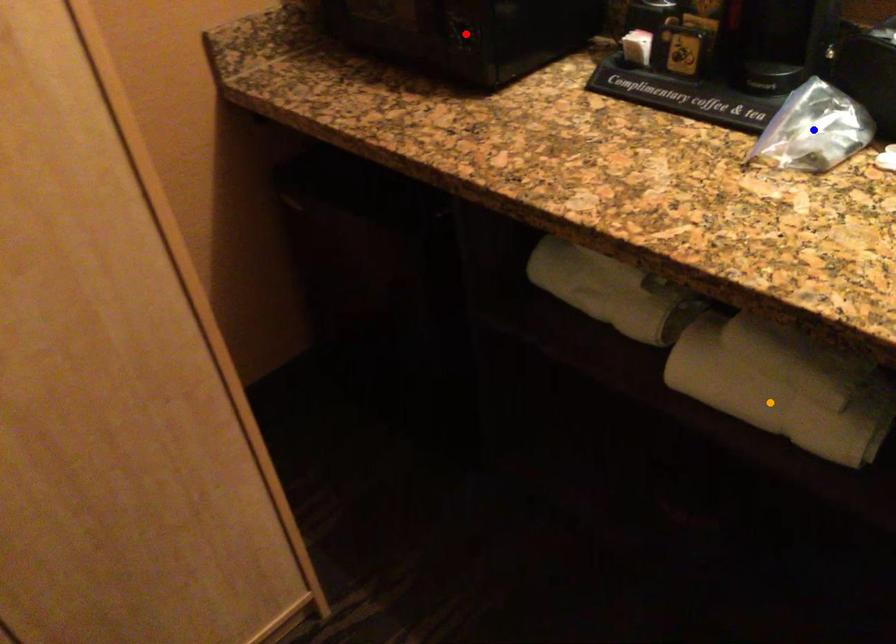
Order these from nearest to farthest:
red point | orange point | blue point

1. orange point
2. blue point
3. red point